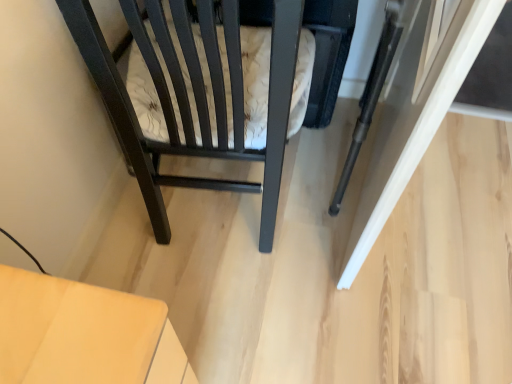
Find the location of a particular element. The height and width of the screenshot is (384, 512). vacant space in front of matte black chair at center is located at coordinates (266, 282).